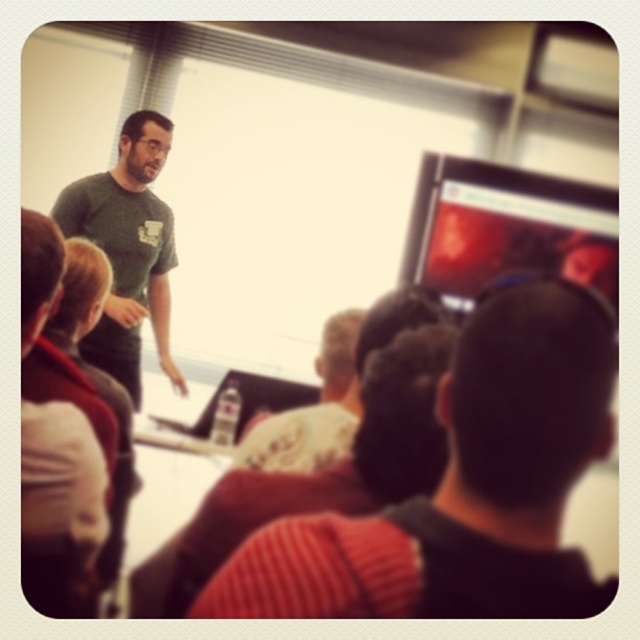
Who is taller, green t-shirt at upper left or white cotton shirt at center?

With more height is green t-shirt at upper left.

Does green t-shirt at upper left have a greater height compared to white cotton shirt at center?

Yes, green t-shirt at upper left is taller than white cotton shirt at center.

In order to click on green t-shirt at upper left in this screenshot , I will do `click(56, 451)`.

Who is more forward, (500, 422) or (275, 444)?

Point (500, 422)

Does knitted red sweater at center appear under white cotton shirt at center?

Indeed, knitted red sweater at center is positioned under white cotton shirt at center.

Measure the distance between point [371,547] and camera.

Point [371,547] is 60.87 centimeters away from camera.

Locate an element on the screen. The width and height of the screenshot is (640, 640). knitted red sweater at center is located at coordinates (464, 486).

The width and height of the screenshot is (640, 640). What do you see at coordinates (464, 486) in the screenshot?
I see `knitted red sweater at center` at bounding box center [464, 486].

Which of these two, knitted red sweater at center or green t-shirt at upper left, stands taller?

With more height is green t-shirt at upper left.

Locate an element on the screen. Image resolution: width=640 pixels, height=640 pixels. knitted red sweater at center is located at coordinates (464, 486).

The height and width of the screenshot is (640, 640). What are the coordinates of `knitted red sweater at center` in the screenshot? It's located at (464, 486).